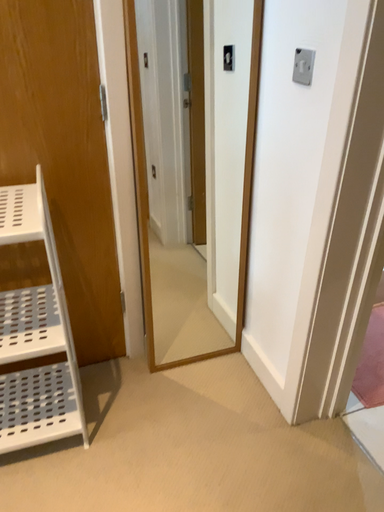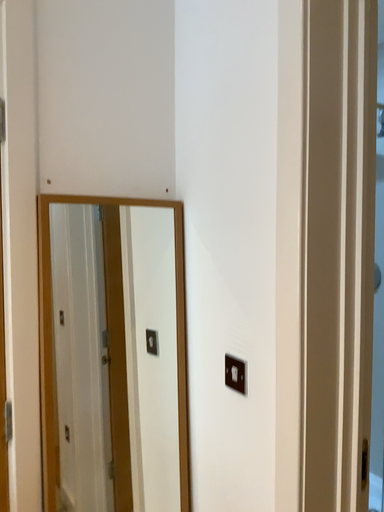
Question: How did the camera likely rotate when shooting the video?

Choices:
 (A) rotated left
 (B) rotated right

Answer: (B)